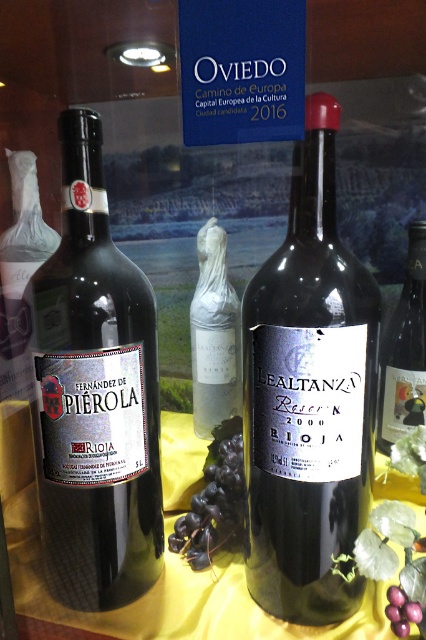
You are holding a camera and want to take a closeup shot of the shiny dark glass bottle at center. The camera requires the subject to be at least 16 inches away to focus properly. Based on the scene description, will the bottle be in focus?

The shiny dark glass bottle at center is 15.75 inches away from camera, which is less than the required 16 inches. Therefore, the camera might not focus properly on the shiny dark glass bottle at center.

You are a wine collector examining the display. You notice a specific point in the image at coordinates (x=94, y=396). What object is located at this point?

The matte black bottle at left is located at point (x=94, y=396).